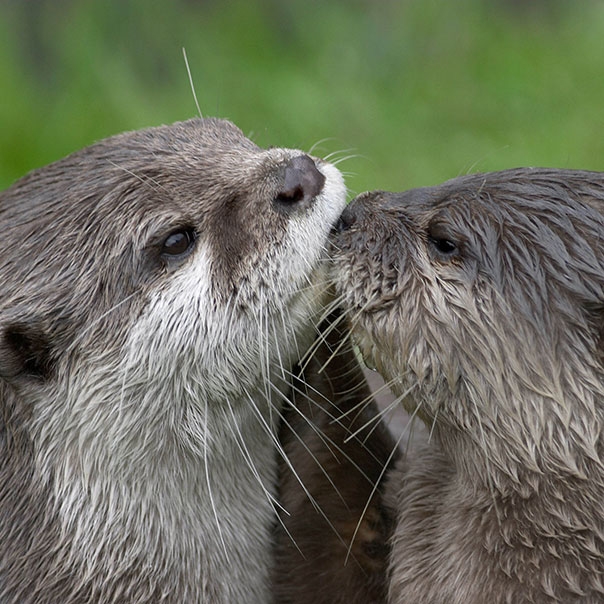
Where is `chest`? chest is located at coordinates (236, 593), (421, 595).